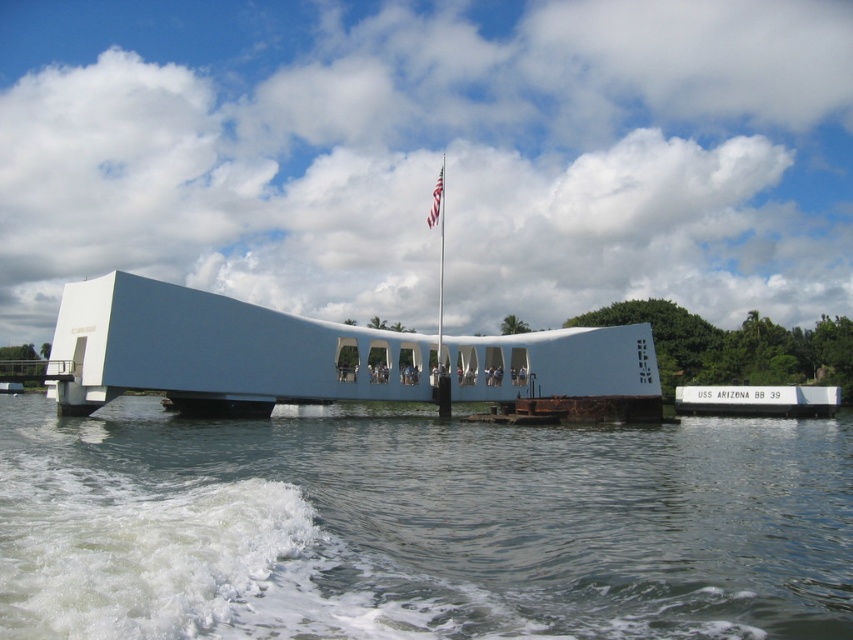
You are a tourist visiting the USS Arizona Memorial. You notice the white smooth memorial at center and the white concrete dock at center. Which object is located to the left of the other?

The white smooth memorial at center is positioned on the left side of white concrete dock at center.

You are a tourist visiting the USS Arizona Memorial. You notice the white concrete dock at center and the white fabric flag at center. From your vantage point, which object is positioned to the right of the other?

The white concrete dock at center is to the right of the white fabric flag at center.

You are a tourist standing at the USS Arizona Memorial and want to take a photo of the clear water at lower center and the white fabric flag at center. If your camera has a maximum zoom range of 30 meters, can you capture both objects in a single frame without moving?

The distance between the clear water at lower center and the white fabric flag at center is 36.64 meters. Since your camera can only zoom up to 30 meters, you cannot capture both objects in a single frame without moving.